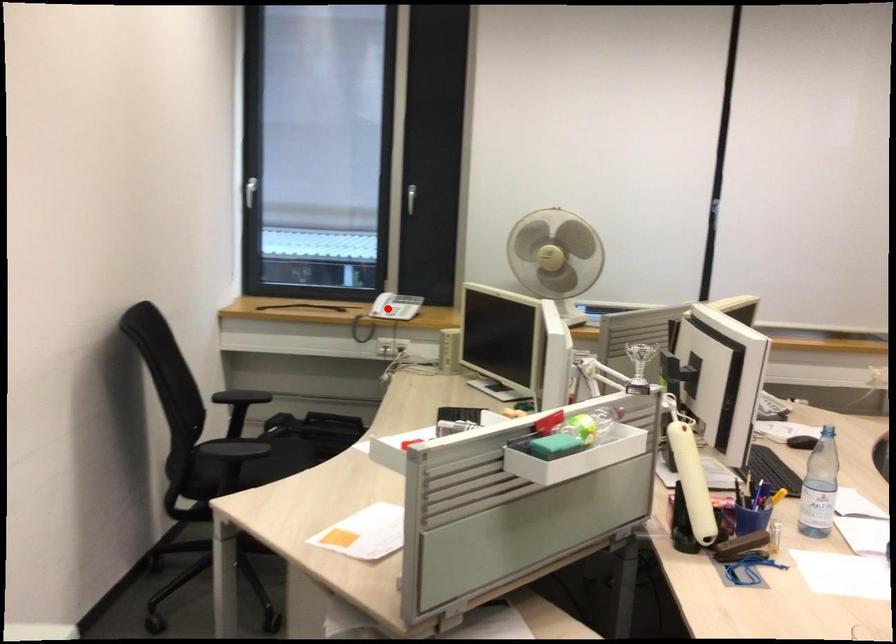
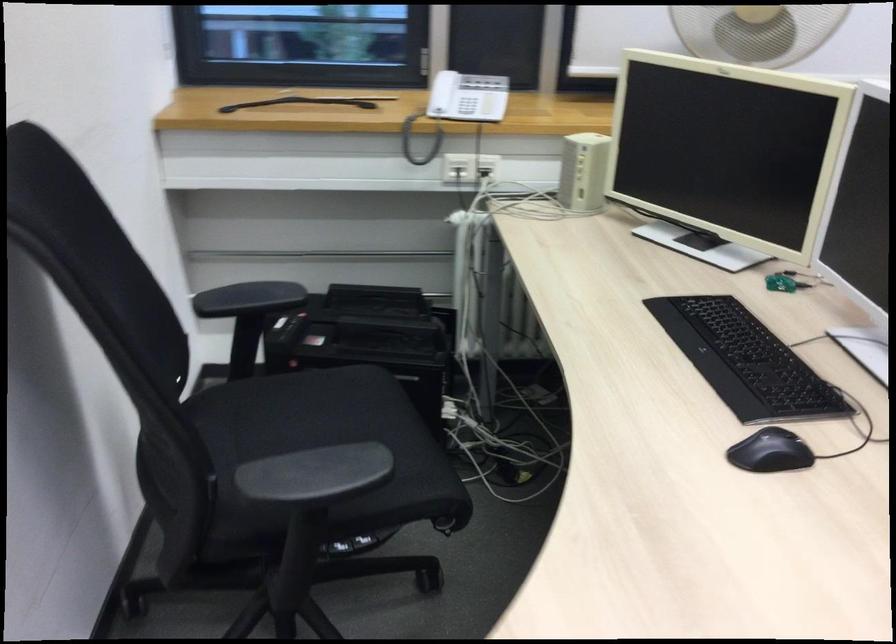
The point at the highlighted location is marked in the first image. Where is the corresponding point in the second image?

(459, 106)